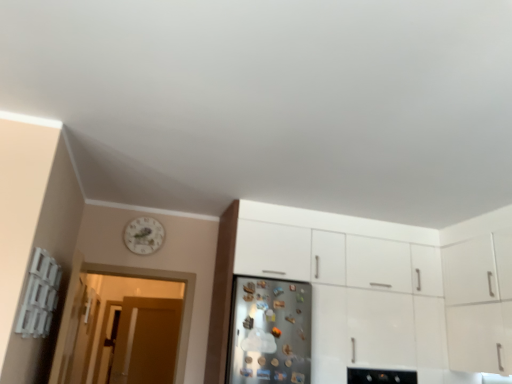
Question: Does translucent wooden door at left touch brown matte door at left?

Choices:
 (A) no
 (B) yes

Answer: (A)

Question: Is translucent wooden door at left surrounding brown matte door at left?

Choices:
 (A) no
 (B) yes

Answer: (A)

Question: Can you confirm if translucent wooden door at left is taller than brown matte door at left?

Choices:
 (A) no
 (B) yes

Answer: (A)

Question: Is translucent wooden door at left located outside brown matte door at left?

Choices:
 (A) no
 (B) yes

Answer: (B)

Question: From a real-world perspective, is translucent wooden door at left beneath brown matte door at left?

Choices:
 (A) yes
 (B) no

Answer: (B)

Question: From the image's perspective, is satin silver fridge at center located above or below brown matte door at left?

Choices:
 (A) above
 (B) below

Answer: (A)

Question: From a real-world perspective, relative to brown matte door at left, is satin silver fridge at center vertically above or below?

Choices:
 (A) above
 (B) below

Answer: (A)

Question: Is satin silver fridge at center to the left or to the right of brown matte door at left in the image?

Choices:
 (A) right
 (B) left

Answer: (A)

Question: Looking at their shapes, would you say satin silver fridge at center is wider or thinner than brown matte door at left?

Choices:
 (A) thin
 (B) wide

Answer: (B)

Question: Is brown matte door at left in front of or behind white glossy cabinet at center in the image?

Choices:
 (A) behind
 (B) front

Answer: (A)

Question: Would you say brown matte door at left is to the left or to the right of white glossy cabinet at center in the picture?

Choices:
 (A) left
 (B) right

Answer: (A)

Question: From the image's perspective, is brown matte door at left above or below white glossy cabinet at center?

Choices:
 (A) below
 (B) above

Answer: (A)

Question: Considering the positions of brown matte door at left and white glossy cabinet at center in the image, is brown matte door at left taller or shorter than white glossy cabinet at center?

Choices:
 (A) short
 (B) tall

Answer: (A)

Question: Visually, is brown matte door at left positioned to the left or to the right of translucent wooden door at left?

Choices:
 (A) left
 (B) right

Answer: (A)

Question: Considering the positions of brown matte door at left and translucent wooden door at left in the image, is brown matte door at left bigger or smaller than translucent wooden door at left?

Choices:
 (A) small
 (B) big

Answer: (B)